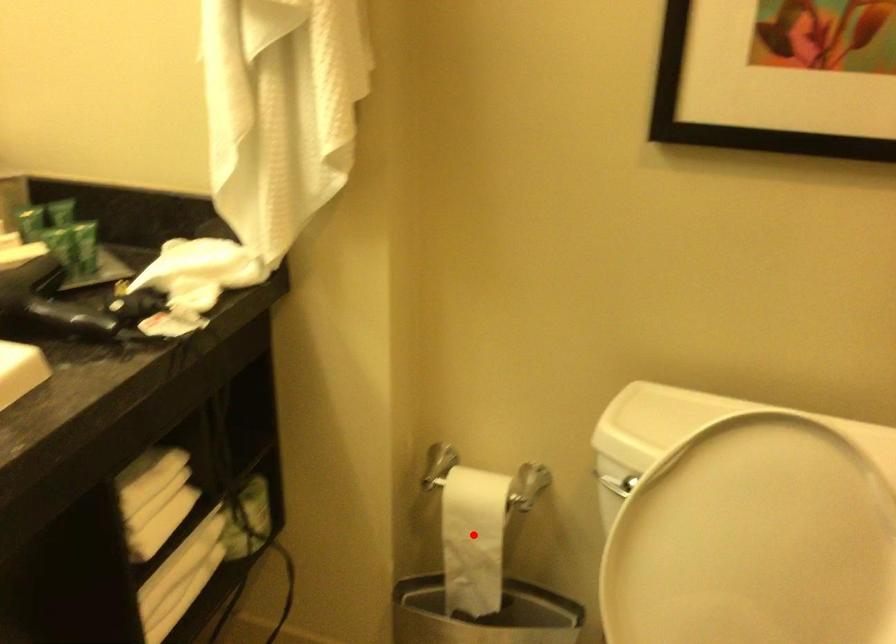
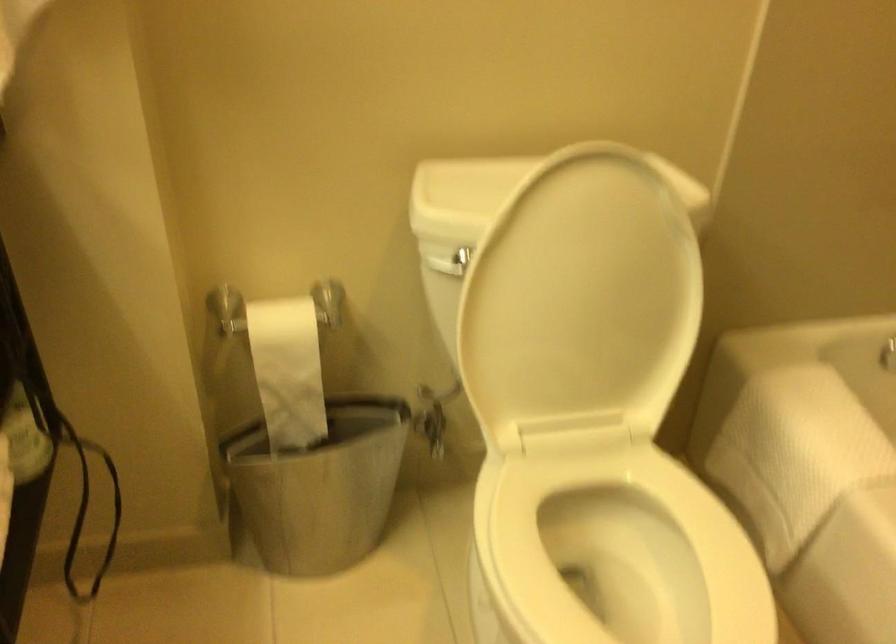
The point at the highlighted location is marked in the first image. Where is the corresponding point in the second image?

(288, 370)